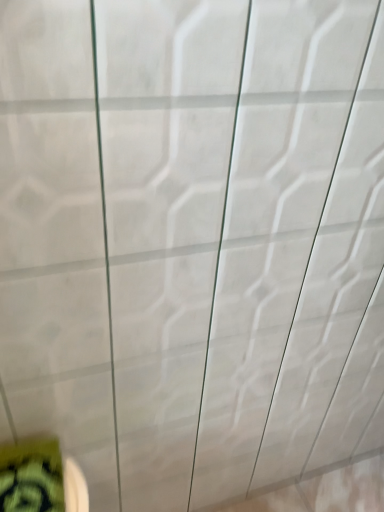
The image size is (384, 512). Find the location of `yellow fabric at lower left`. yellow fabric at lower left is located at coordinates (31, 477).

The height and width of the screenshot is (512, 384). What do you see at coordinates (31, 477) in the screenshot? I see `yellow fabric at lower left` at bounding box center [31, 477].

Identify the location of yellow fabric at lower left. (31, 477).